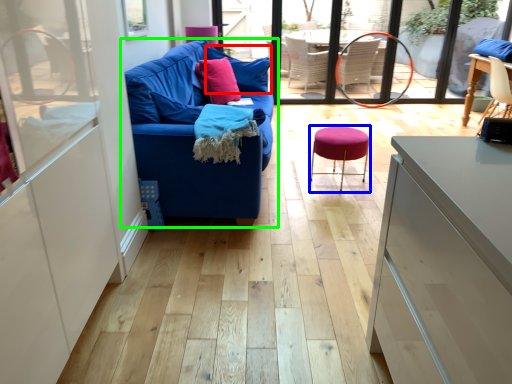
Question: Which is farther away from pillow (highlighted by a red box)? bar stool (highlighted by a blue box) or studio couch (highlighted by a green box)?

Choices:
 (A) bar stool
 (B) studio couch

Answer: (A)